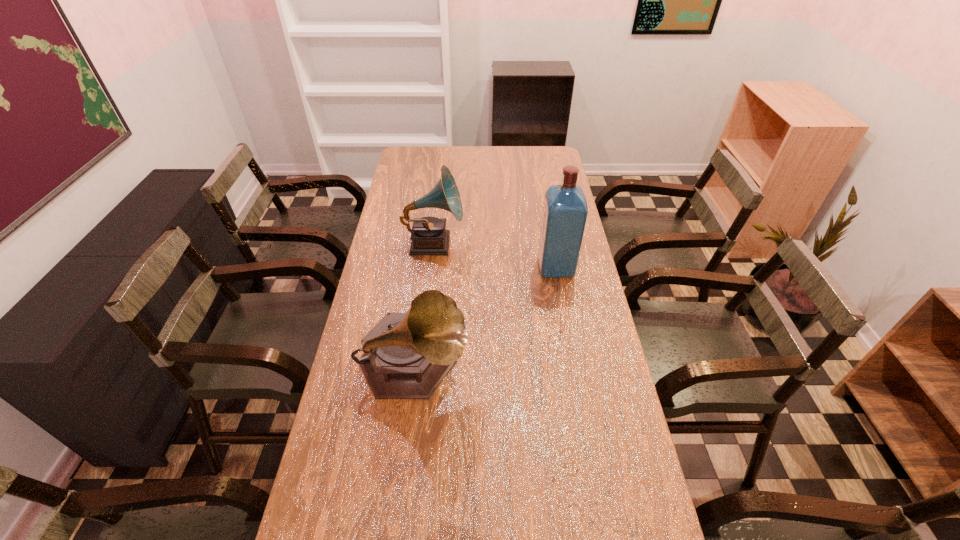
This screenshot has height=540, width=960. In the image, there is a desktop. Identify the location of vacant space at the far edge. (484, 167).

The width and height of the screenshot is (960, 540). Identify the location of free location at the left edge. click(x=396, y=253).

In the image, there is a desktop. Where is `free space at the right edge`? The height and width of the screenshot is (540, 960). free space at the right edge is located at coordinates (569, 388).

The width and height of the screenshot is (960, 540). What are the coordinates of `free region at the far right corner` in the screenshot? It's located at (531, 163).

The height and width of the screenshot is (540, 960). Find the location of `free space that is in between the farther phonograph record and the tallest object`. free space that is in between the farther phonograph record and the tallest object is located at coordinates (494, 255).

Image resolution: width=960 pixels, height=540 pixels. I want to click on empty location between the farther phonograph record and the liquor, so click(x=494, y=255).

Locate an element on the screen. free space between the nearest object and the rightmost object is located at coordinates (x=485, y=318).

Find the location of a particular element. Image resolution: width=960 pixels, height=540 pixels. object that stands as the closest to the liquor is located at coordinates pyautogui.click(x=429, y=236).

Locate an element on the screen. The image size is (960, 540). the second closest object to the farther phonograph record is located at coordinates (407, 355).